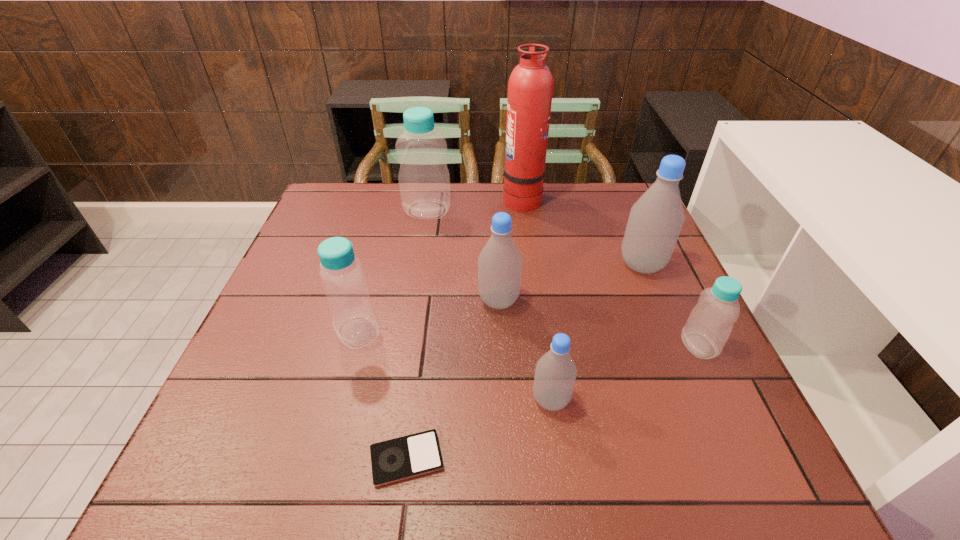
Where is `fire extinguisher`? fire extinguisher is located at coordinates (x=530, y=88).

Find the location of a particular element. The image size is (960, 540). the biggest blue bottle is located at coordinates (424, 181).

The image size is (960, 540). Identify the location of the farthest bottle. (424, 181).

You are a GUI agent. You are given a task and a screenshot of the screen. Output one action in this format:
    pyautogui.click(x=<x>, y=<y>)
    Task: Click on the biggest gray bottle
    The width and height of the screenshot is (960, 540).
    Given the screenshot: What is the action you would take?
    pyautogui.click(x=655, y=221)

Locate an element on the screen. the farthest gray bottle is located at coordinates (655, 221).

This screenshot has width=960, height=540. What are the coordinates of `the second smallest blue bottle` in the screenshot? It's located at (342, 276).

Where is `the second nearest gray bottle`? The image size is (960, 540). the second nearest gray bottle is located at coordinates (499, 263).

Locate an element on the screen. the leftmost gray bottle is located at coordinates (499, 263).

Identify the location of the rightmost blue bottle. This screenshot has width=960, height=540. (709, 325).

Where is `the second nearest object`? the second nearest object is located at coordinates (555, 374).